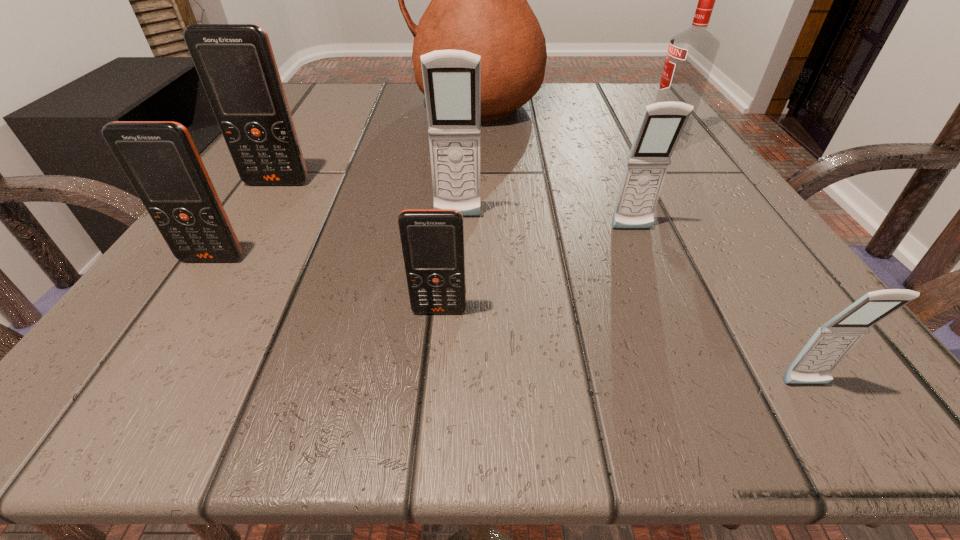
This screenshot has height=540, width=960. What are the coordinates of `vacant space that satisfies the following two spatial constraints: 1. on the side of the tallest object with the handle; 2. on the front-facing side of the fifth nearest cellular telephone` in the screenshot? It's located at (473, 217).

Identify the location of vacant point that satisfies the following two spatial constraints: 1. on the side of the pitcher with the handle; 2. on the screen of the second biggest orange cellular telephone. (472, 259).